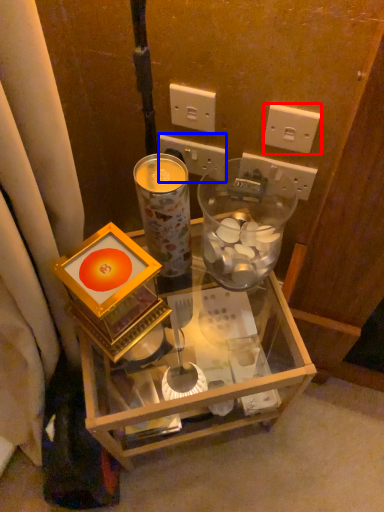
Question: Which point is further to the camera, power outlet (highlighted by a red box) or power outlet (highlighted by a blue box)?

Choices:
 (A) power outlet
 (B) power outlet

Answer: (B)